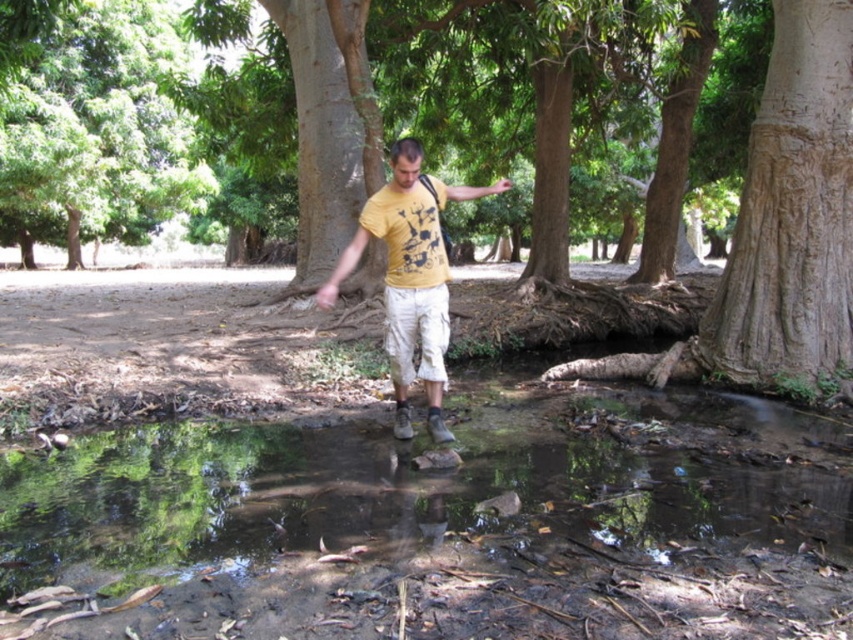
This screenshot has width=853, height=640. What are the coordinates of `clear water at center` in the screenshot? It's located at (421, 540).

Which of these two, clear water at center or yellow matte t-shirt at center, stands taller?

With more height is yellow matte t-shirt at center.

Describe the element at coordinates (421, 540) in the screenshot. I see `clear water at center` at that location.

Find the location of a particular element. Image resolution: width=853 pixels, height=640 pixels. clear water at center is located at coordinates (421, 540).

Find the location of a particular element. clear water at center is located at coordinates [x=421, y=540].

Is clear water at center positioned at the back of green leafy tree at upper left?

That is False.

Identify the location of clear water at center. (421, 540).

Does clear water at center have a larger size compared to brown rough tree at center?

Yes.

Does clear water at center appear over brown rough tree at center?

No, clear water at center is not above brown rough tree at center.

You are a GUI agent. You are given a task and a screenshot of the screen. Output one action in this format:
    pyautogui.click(x=<x>, y=<y>)
    Task: Click on the clear water at center
    The width and height of the screenshot is (853, 640).
    Given the screenshot: What is the action you would take?
    pyautogui.click(x=421, y=540)

This screenshot has width=853, height=640. What are the coordinates of `clear water at center` in the screenshot? It's located at (x=421, y=540).